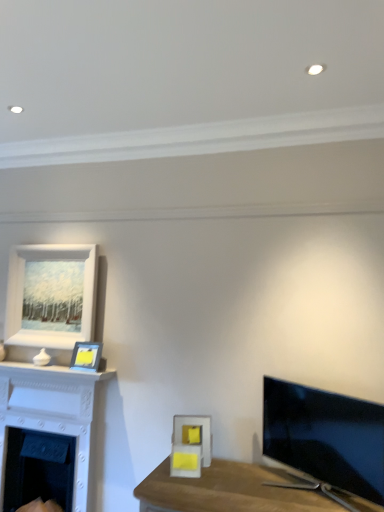
Question: From a real-world perspective, is white matte picture frame at upper left, marked as the third picture frame in a bottom-to-top arrangement, physically below white matte fireplace at lower left, the first fireplace from the bottom?

Choices:
 (A) yes
 (B) no

Answer: (B)

Question: Considering the relative positions of white matte picture frame at upper left, which ranks as the third picture frame in front-to-back order, and white matte fireplace at lower left, placed as the second fireplace when sorted from top to bottom, in the image provided, is white matte picture frame at upper left, which ranks as the third picture frame in front-to-back order, to the right of white matte fireplace at lower left, placed as the second fireplace when sorted from top to bottom, from the viewer's perspective?

Choices:
 (A) no
 (B) yes

Answer: (B)

Question: From a real-world perspective, is white matte picture frame at upper left, placed as the first picture frame when sorted from top to bottom, physically above white matte fireplace at lower left, the first fireplace from the bottom?

Choices:
 (A) yes
 (B) no

Answer: (A)

Question: From the image's perspective, is white matte picture frame at upper left, marked as the third picture frame in a bottom-to-top arrangement, on top of white matte fireplace at lower left, placed as the second fireplace when sorted from top to bottom?

Choices:
 (A) no
 (B) yes

Answer: (B)

Question: Can you confirm if white matte picture frame at upper left, arranged as the 3th picture frame when viewed from the right, is bigger than white matte fireplace at lower left, the first fireplace from the bottom?

Choices:
 (A) no
 (B) yes

Answer: (A)

Question: From a real-world perspective, is white glossy fireplace at left, the second fireplace when ordered from bottom to top, physically located above or below matte yellow picture frame at upper left, the second picture frame from the right?

Choices:
 (A) below
 (B) above

Answer: (A)

Question: Is white glossy fireplace at left, placed as the 1th fireplace when sorted from top to bottom, in front of or behind matte yellow picture frame at upper left, arranged as the second picture frame when ordered from the bottom, in the image?

Choices:
 (A) behind
 (B) front

Answer: (B)

Question: Is white glossy fireplace at left, the second fireplace when ordered from bottom to top, taller or shorter than matte yellow picture frame at upper left, the second picture frame from the back?

Choices:
 (A) tall
 (B) short

Answer: (A)

Question: Would you say white glossy fireplace at left, the second fireplace when ordered from bottom to top, is inside or outside matte yellow picture frame at upper left, arranged as the second picture frame when viewed from the top?

Choices:
 (A) outside
 (B) inside

Answer: (A)

Question: From a real-world perspective, is matte yellow picture frame at upper left, the second picture frame from the right, above or below satin black tv at right?

Choices:
 (A) below
 (B) above

Answer: (B)

Question: Choose the correct answer: Is matte yellow picture frame at upper left, the second picture frame from the back, inside satin black tv at right or outside it?

Choices:
 (A) inside
 (B) outside

Answer: (B)

Question: Based on their sizes in the image, would you say matte yellow picture frame at upper left, the second picture frame from the back, is bigger or smaller than satin black tv at right?

Choices:
 (A) small
 (B) big

Answer: (A)

Question: From their relative heights in the image, would you say matte yellow picture frame at upper left, the second picture frame from the right, is taller or shorter than satin black tv at right?

Choices:
 (A) short
 (B) tall

Answer: (A)

Question: Based on their positions, is matte yellow picture frame at upper left, arranged as the second picture frame when ordered from the bottom, located to the left or right of matte yellow picture frame at center, which is counted as the 3th picture frame, starting from the back?

Choices:
 (A) left
 (B) right

Answer: (A)

Question: Considering their positions, is matte yellow picture frame at upper left, the second picture frame viewed from the left, located in front of or behind matte yellow picture frame at center, marked as the 1th picture frame in a right-to-left arrangement?

Choices:
 (A) behind
 (B) front

Answer: (A)